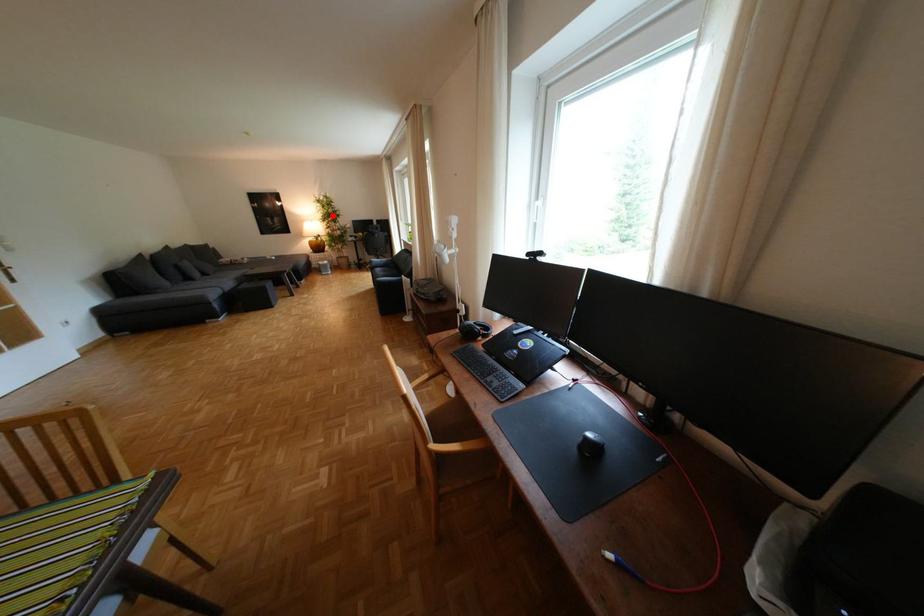
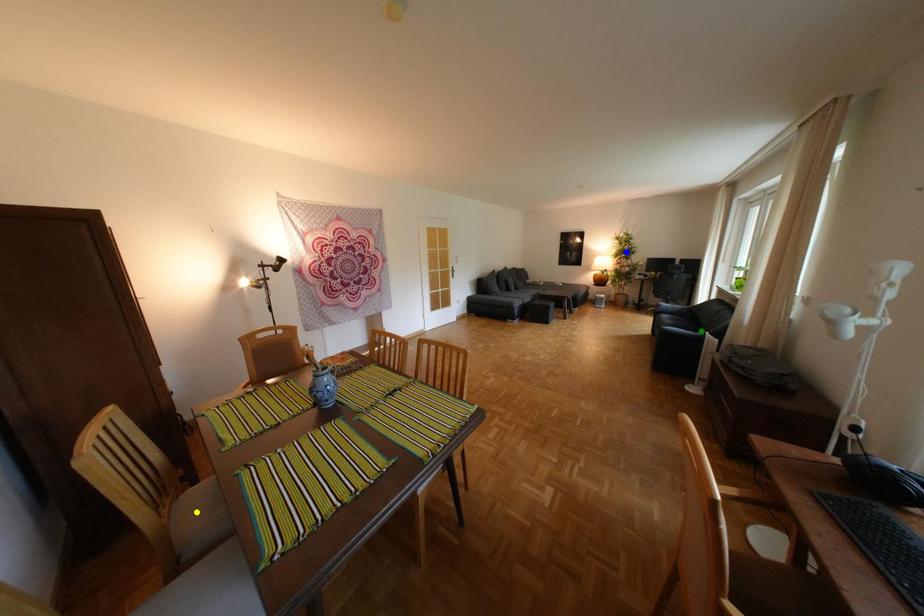
Question: I am providing you with two images of the same scene from different viewpoints. A red point is marked on the first image. You are given multiple points on the second image. Which point in image 2 represents the same 3d spot as the red point in image 1?

Choices:
 (A) green point
 (B) yellow point
 (C) blue point

Answer: (C)